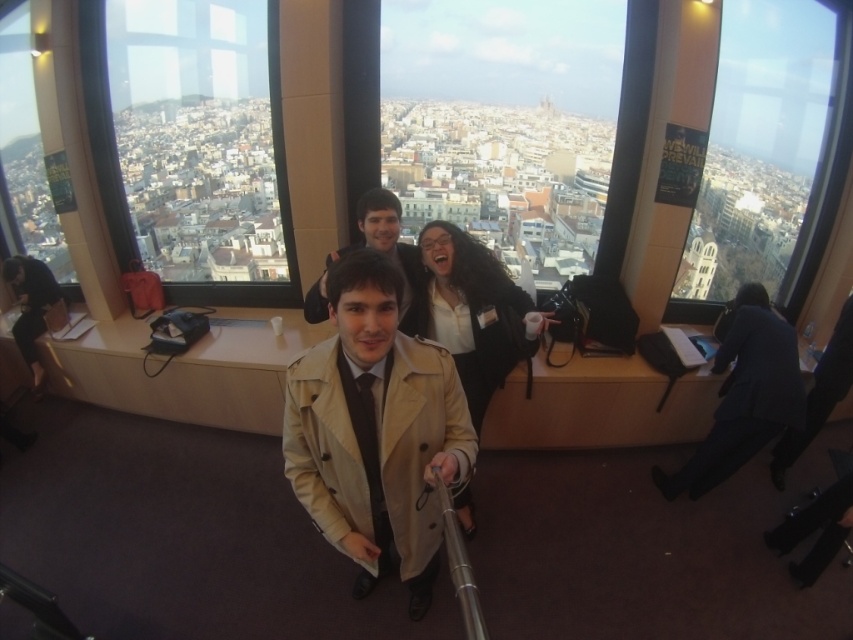
Question: Is transparent glass window at upper left bigger than dark blue suit at right?

Choices:
 (A) no
 (B) yes

Answer: (B)

Question: Is the position of beige fabric coat at center more distant than that of light beige trench coat at center?

Choices:
 (A) no
 (B) yes

Answer: (B)

Question: Can you confirm if beige fabric trench coat at center is positioned to the right of dark blue suit at right?

Choices:
 (A) yes
 (B) no

Answer: (B)

Question: Which object is positioned closest to the beige fabric coat at center?

Choices:
 (A) light beige trench coat at center
 (B) dark blue suit at right

Answer: (A)

Question: Estimate the real-world distances between objects in this image. Which object is farther from the light beige trench coat at center?

Choices:
 (A) beige fabric coat at center
 (B) beige fabric trench coat at center
 (C) dark brown leather jacket at left

Answer: (C)

Question: Which point is farther from the camera taking this photo?

Choices:
 (A) (688, 483)
 (B) (347, 520)
 (C) (258, 72)
 (D) (26, 292)

Answer: (C)